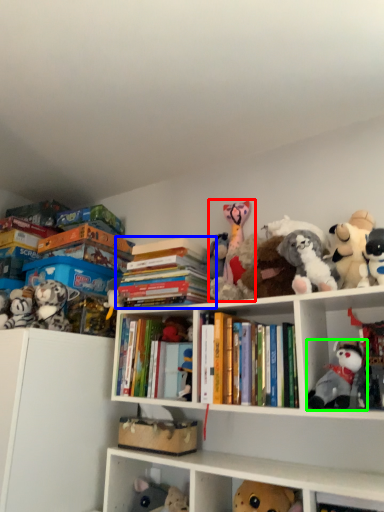
Question: Which object is positioned closest to toy (highlighted by a red box)? Select from book (highlighted by a blue box) and toy (highlighted by a green box).

Choices:
 (A) book
 (B) toy

Answer: (A)